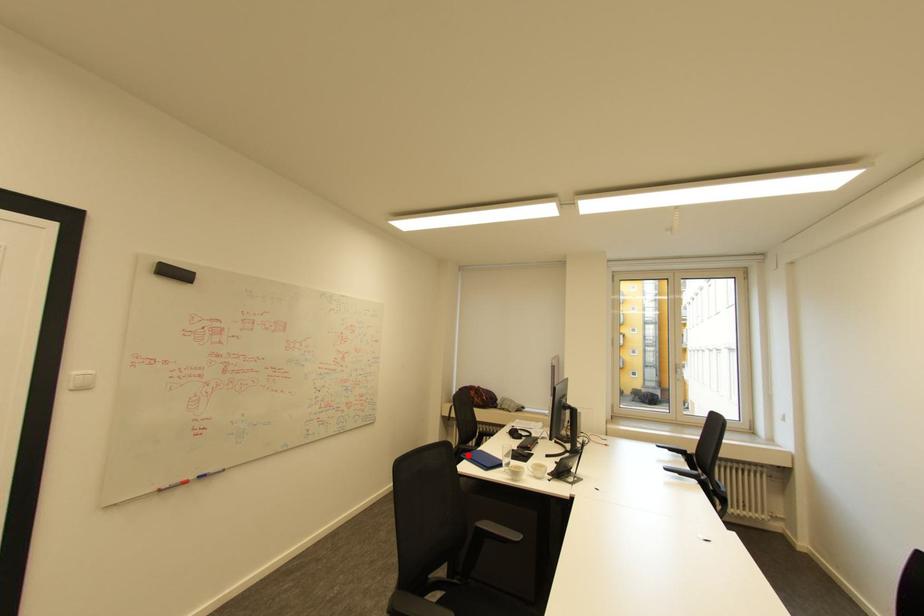
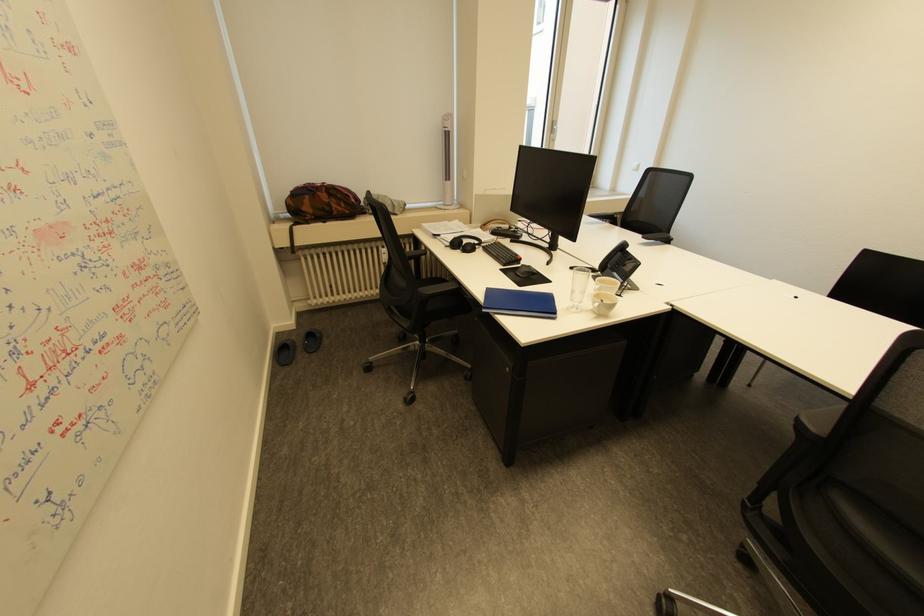
Locate, in the second image, the point that corresponds to the highlighted location in the first image.

(491, 310)